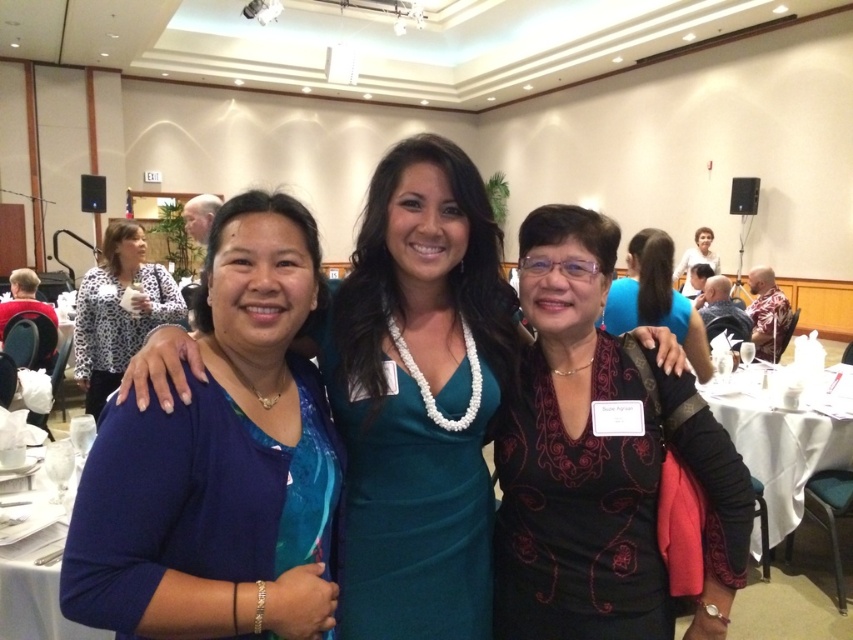
Which is more to the right, blue fabric shirt at left or white glossy table at lower left?

Positioned to the right is blue fabric shirt at left.

Who is more forward, (276,236) or (3,573)?

Point (276,236)

You are a GUI agent. You are given a task and a screenshot of the screen. Output one action in this format:
    pyautogui.click(x=<x>, y=<y>)
    Task: Click on the blue fabric shirt at left
    This screenshot has width=853, height=640.
    Given the screenshot: What is the action you would take?
    pyautogui.click(x=219, y=461)

Can you confirm if black textured blouse at center is bigger than leopard print blouse at left?

No, black textured blouse at center is not bigger than leopard print blouse at left.

Who is taller, black textured blouse at center or leopard print blouse at left?

leopard print blouse at left is taller.

Describe the element at coordinates (606, 465) in the screenshot. I see `black textured blouse at center` at that location.

The height and width of the screenshot is (640, 853). Identify the location of black textured blouse at center. (606, 465).

Does point (215, 228) come farther from viewer compared to point (553, 211)?

No.

Does point (236, 465) come in front of point (509, 605)?

Yes, it is.

Image resolution: width=853 pixels, height=640 pixels. I want to click on blue fabric shirt at left, so click(219, 461).